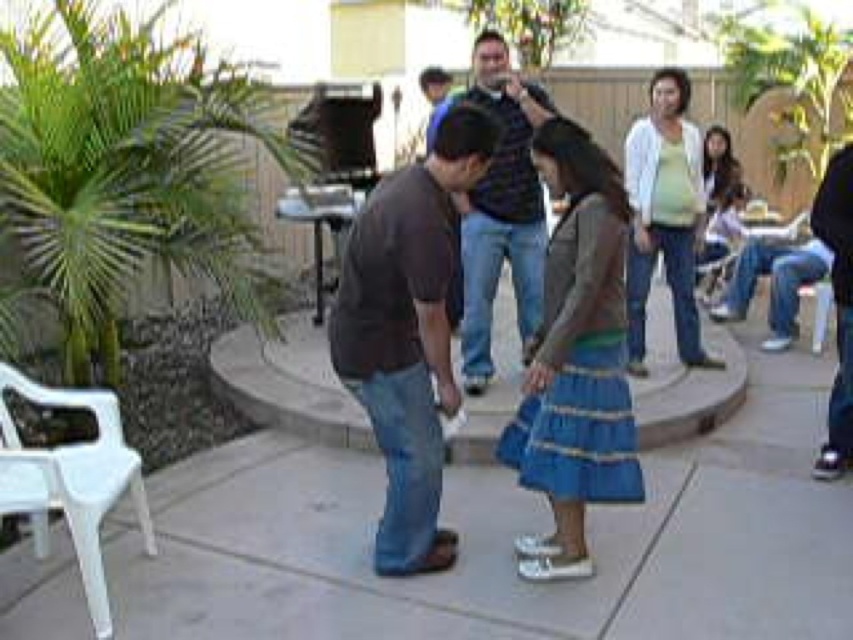
Question: Which point appears farthest from the camera in this image?

Choices:
 (A) (99, 572)
 (B) (434, 262)
 (C) (677, 150)

Answer: (C)

Question: Estimate the real-world distances between objects in this image. Which object is farther from the dark blue jeans at center?

Choices:
 (A) blue textured skirt at center
 (B) light green sweater at upper right

Answer: (A)

Question: Which of the following is the farthest from the observer?

Choices:
 (A) (76, 531)
 (B) (546, 368)
 (C) (631, 288)
 (D) (442, 125)

Answer: (C)

Question: Does light green sweater at upper right lie behind blue denim jeans at center?

Choices:
 (A) no
 (B) yes

Answer: (A)

Question: Is the position of brown cotton shirt at center more distant than that of white plastic chair at lower left?

Choices:
 (A) no
 (B) yes

Answer: (B)

Question: Is brown cotton shirt at center wider than light green sweater at upper right?

Choices:
 (A) yes
 (B) no

Answer: (B)